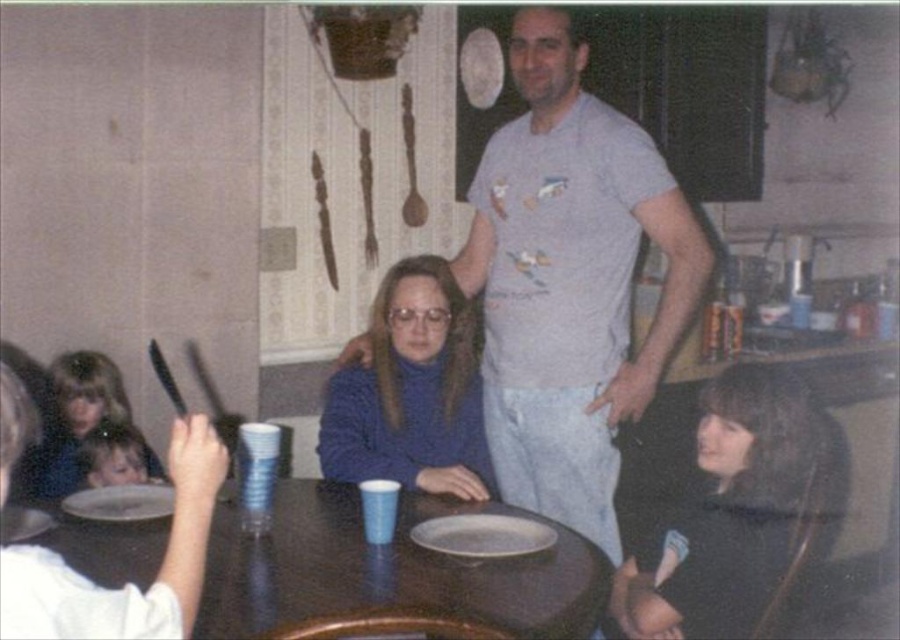
You are a guest at this gathering and need to place your coat on the floor next to the white matte plate at lower left without covering the purple turtleneck sweater at center. Is this possible given their sizes?

The purple turtleneck sweater at center is taller than the white matte plate at lower left. Since the sweater is taller, placing the coat next to the plate might still be possible as long as there is enough space around the plate and the sweater doesn

You are planning to place a smooth plastic spoon at upper left on the brown wooden table at center. Based on their sizes, will the spoon fit on the table?

The brown wooden table at center has a larger size compared to smooth plastic spoon at upper left, so the spoon will fit on the table since the table is bigger.

You are at a family gathering and want to pass a dish from the white matte plate at lower left to someone wearing the purple turtleneck sweater at center. Which direction should you move the dish?

You should move the dish to the right, as the purple turtleneck sweater at center is located to the right of the white matte plate at lower left.